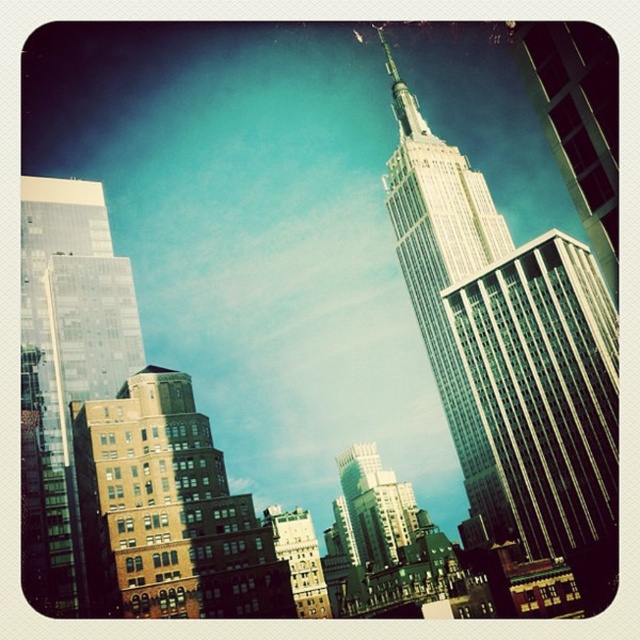
Between brown brick building at lower left and white glass tower at center, which one appears on the right side from the viewer's perspective?

Positioned to the right is white glass tower at center.

Is point (234, 577) positioned behind point (468, 499)?

No.

This screenshot has height=640, width=640. I want to click on brown brick building at lower left, so click(168, 509).

Does glassy reflective skyscraper at left have a lesser width compared to glassy skyscraper at upper right?

Correct, glassy reflective skyscraper at left's width is less than glassy skyscraper at upper right's.

Does glassy reflective skyscraper at left come behind glassy skyscraper at upper right?

That is True.

Where is `glassy reflective skyscraper at left`? The width and height of the screenshot is (640, 640). glassy reflective skyscraper at left is located at coordinates (72, 342).

Does white glass tower at center appear over glassy skyscraper at upper right?

Indeed, white glass tower at center is positioned over glassy skyscraper at upper right.

Is white glass tower at center to the left of glassy skyscraper at upper right from the viewer's perspective?

Yes, white glass tower at center is to the left of glassy skyscraper at upper right.

This screenshot has height=640, width=640. I want to click on white glass tower at center, so click(x=445, y=280).